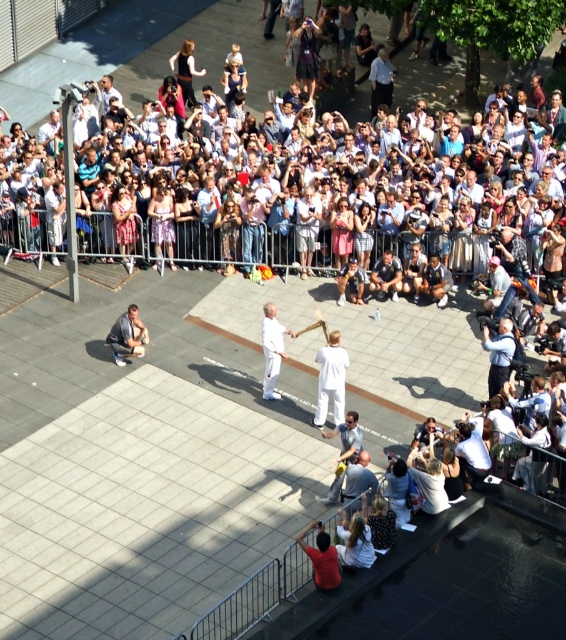
You are a photographer standing at the edge of the event area. You need to capture a photo that includes both the light brown leather jacket at center and the light brown leather jacket at lower left. Given that your camera has a maximum zoom range of 10 meters, can you fit both jackets into the frame without moving your position?

The light brown leather jacket at center is 4.41 meters from the light brown leather jacket at lower left. Since your camera can zoom up to 10 meters, which is greater than the 4.41 meters distance between them, you can fit both jackets into the frame without moving.

Looking at this image, you are a photographer at the event and want to capture a closeup of the light brown leather jacket at center. The jacket is located at point (306, 228). Your camera has a zoom range that can focus on objects within a 0.2 radius. Is the light brown leather jacket at center within your camera focus range?

The light brown leather jacket at center is represented by point (306, 228). Since the camera can focus within a 0.2 radius, the jacket is within the focus range as its coordinates fall within that area.

You are a photographer at the event and want to capture both the light brown leather jacket at center and the light brown leather jacket at lower left in a single photo. Which jacket should you focus on to ensure both are in frame?

You should focus on the light brown leather jacket at center because it is much taller than the light brown leather jacket at lower left, so positioning the camera to include its height will naturally include the shorter one in the frame.